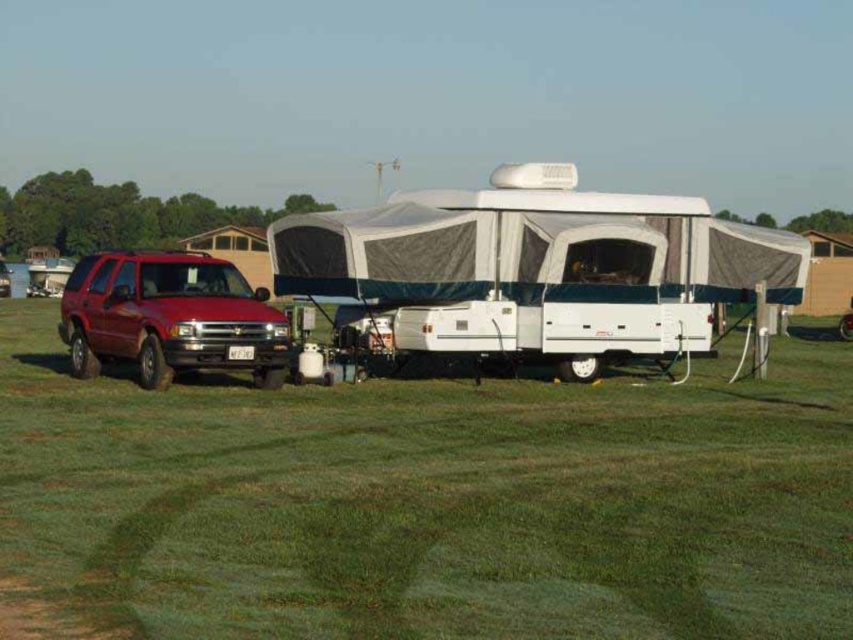
Is green grassy field at center bigger than white fabric tent at center?

Actually, green grassy field at center might be smaller than white fabric tent at center.

Which is more to the left, green grassy field at center or white fabric tent at center?

Positioned to the left is green grassy field at center.

You are a GUI agent. You are given a task and a screenshot of the screen. Output one action in this format:
    pyautogui.click(x=<x>, y=<y>)
    Task: Click on the green grassy field at center
    The image size is (853, 640).
    Given the screenshot: What is the action you would take?
    pyautogui.click(x=424, y=504)

Find the location of a particular element. This screenshot has height=640, width=853. green grassy field at center is located at coordinates (424, 504).

Is green grassy field at center positioned before matte red suv at left?

Yes.

Image resolution: width=853 pixels, height=640 pixels. Identify the location of green grassy field at center. (424, 504).

Does point (80, 408) come behind point (86, 282)?

No, (80, 408) is closer to viewer.

Locate an element on the screen. This screenshot has height=640, width=853. green grassy field at center is located at coordinates (424, 504).

Is white fabric tent at center wider than matte red suv at left?

Yes, white fabric tent at center is wider than matte red suv at left.

Does point (309, 260) come closer to viewer compared to point (71, 348)?

No, it is behind (71, 348).

In order to click on white fabric tent at center in this screenshot , I will do `click(538, 268)`.